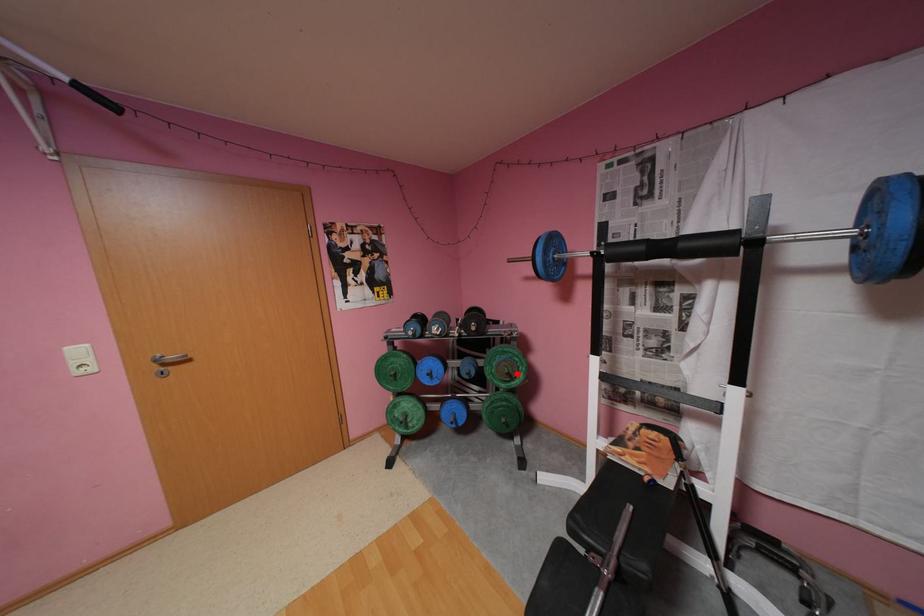
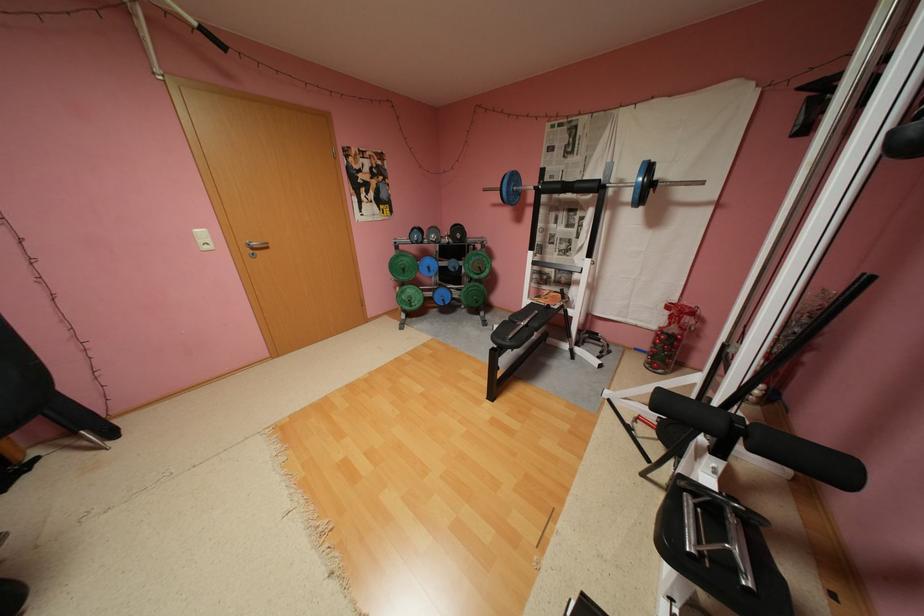
In the second image, find the point that corresponds to the highlighted location in the first image.

(489, 267)